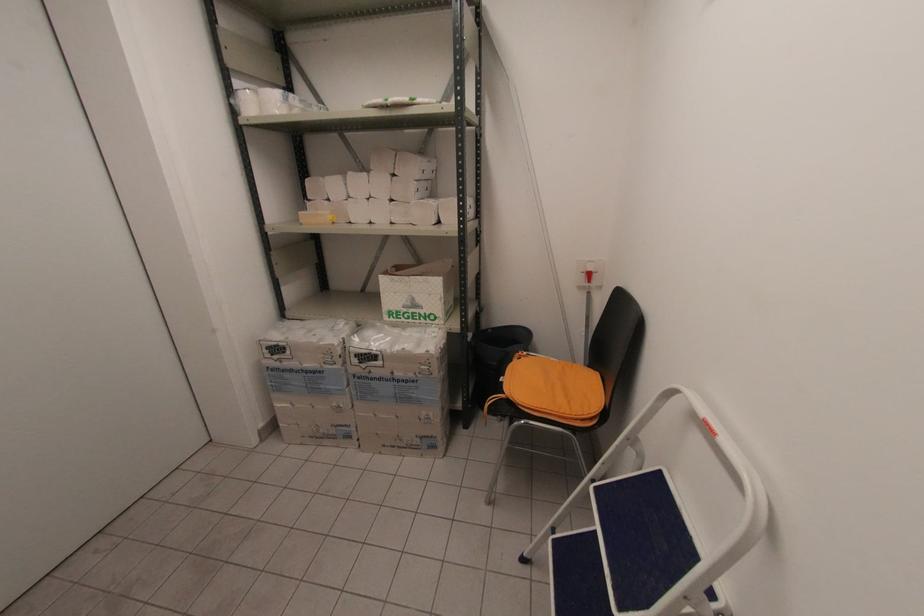
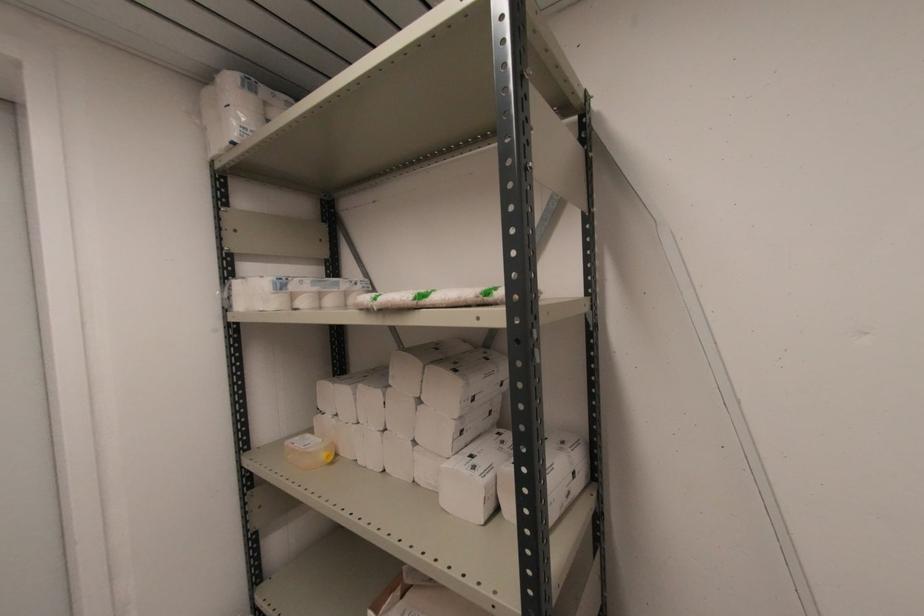
Question: In a continuous first-person perspective shot, in which direction is the camera moving?

Choices:
 (A) Left
 (B) Right
 (C) Forward
 (D) Backward

Answer: (C)